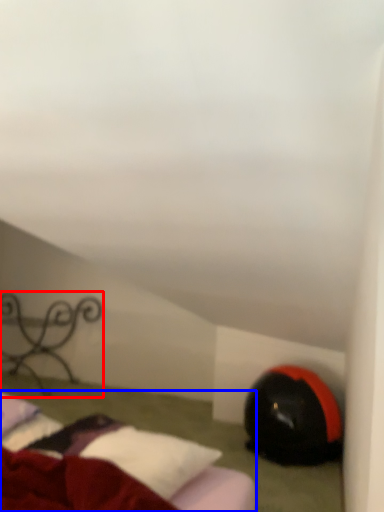
Question: Among these objects, which one is farthest to the camera, furniture (highlighted by a red box) or bed (highlighted by a blue box)?

Choices:
 (A) furniture
 (B) bed

Answer: (A)